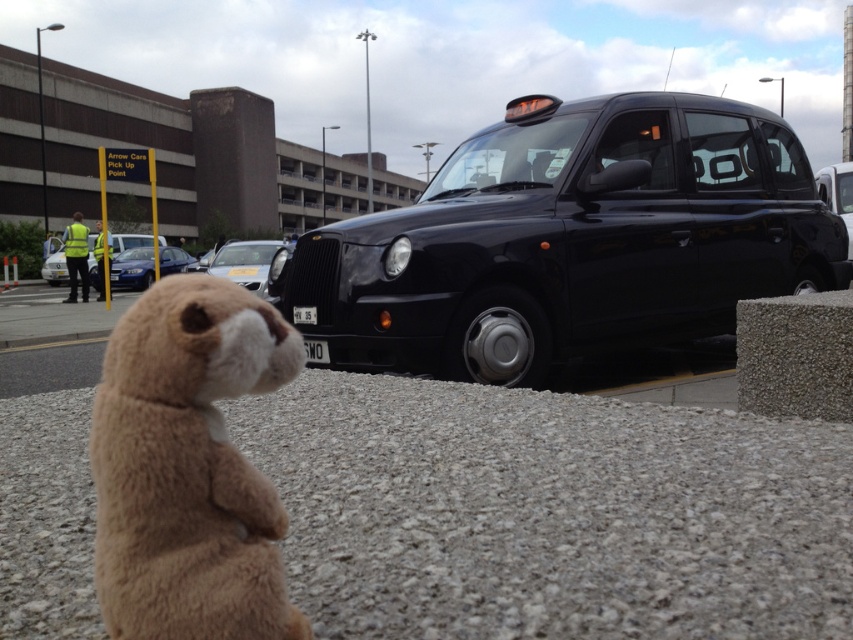
Question: Can you confirm if gray gravel at lower center is positioned below brown plush toy at lower left?

Choices:
 (A) no
 (B) yes

Answer: (B)

Question: Which of the following is the farthest from the observer?

Choices:
 (A) brown plush toy at lower left
 (B) shiny black taxi at center
 (C) silver metallic car at center
 (D) blue metallic sedan at center

Answer: (D)

Question: In this image, where is gray gravel at lower center located relative to shiny black taxi at center?

Choices:
 (A) above
 (B) below

Answer: (B)

Question: Which of the following is the farthest from the observer?

Choices:
 (A) (578, 122)
 (B) (282, 241)
 (C) (131, 435)
 (D) (814, 545)

Answer: (B)

Question: Which object is positioned closest to the silver metallic car at center?

Choices:
 (A) shiny black taxi at center
 (B) blue metallic sedan at center
 (C) brown plush toy at lower left

Answer: (B)

Question: Is brown plush toy at lower left smaller than blue metallic sedan at center?

Choices:
 (A) no
 (B) yes

Answer: (B)